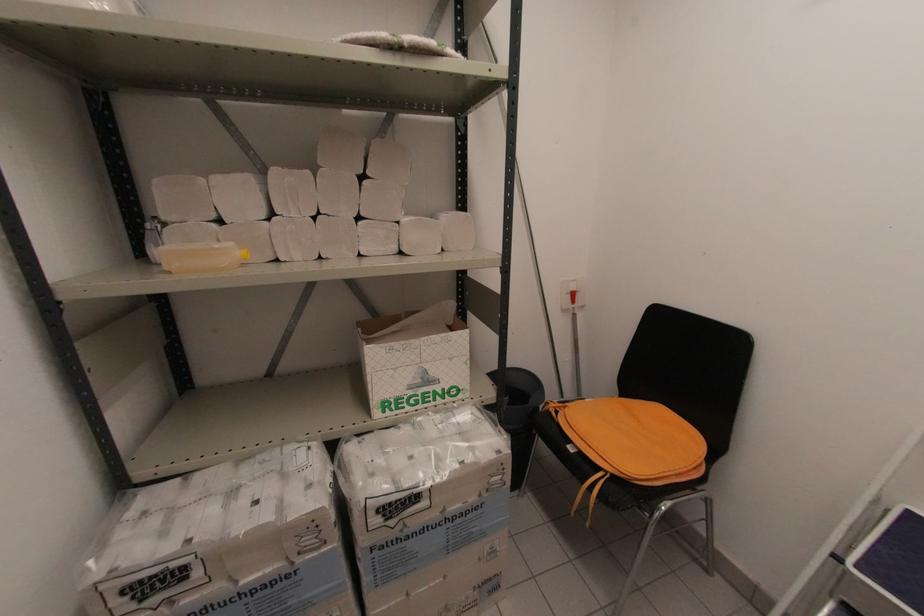
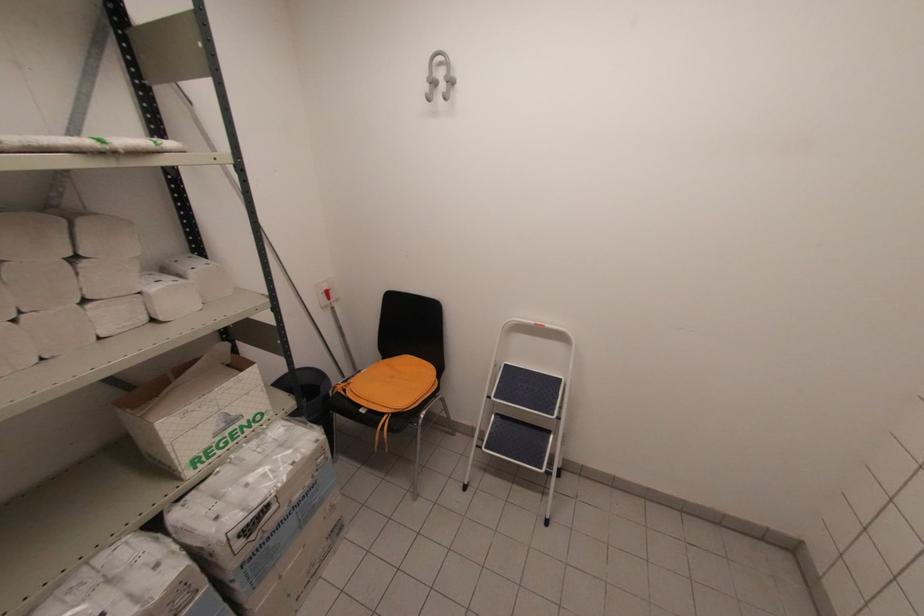
In the second image, find the point that corresponds to point (408, 539) in the first image.

(271, 539)